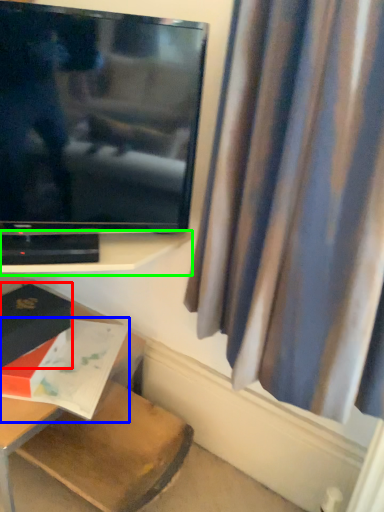
Question: Based on their relative distances, which object is farther from book (highlighted by a red box)? Choose from book (highlighted by a blue box) and shelf (highlighted by a green box).

Choices:
 (A) book
 (B) shelf

Answer: (B)